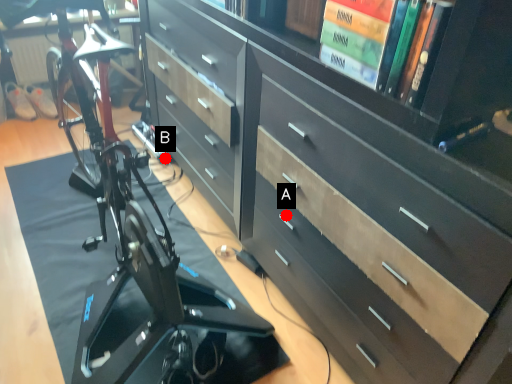
Question: Two points are circled on the image, labeled by A and B beside each circle. Among these points, which one is nearest to the camera?

Choices:
 (A) A is closer
 (B) B is closer

Answer: (A)